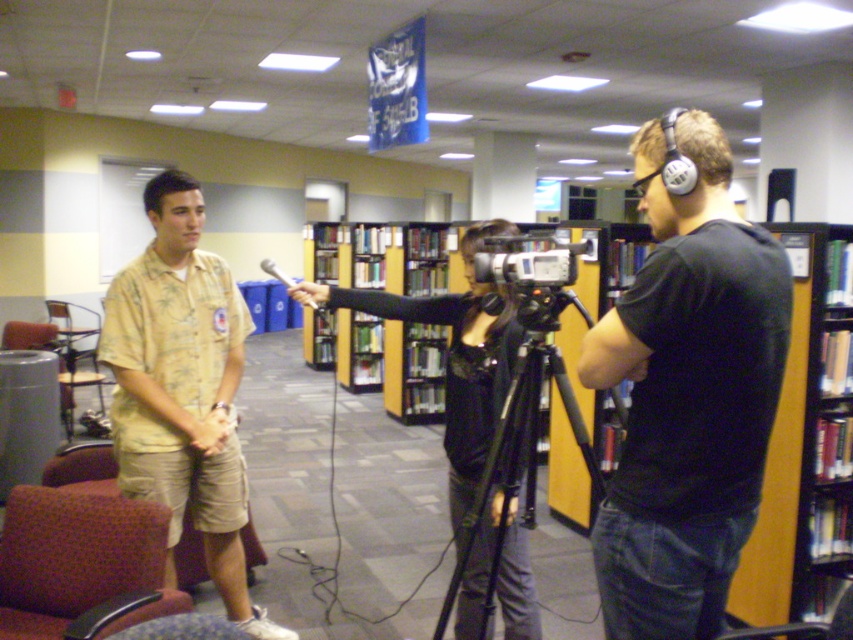
Measure the distance between black matte headphones at right and black matte tripod at center.

They are 16.38 inches apart.

Is point (664, 152) closer to viewer compared to point (531, 301)?

Yes, it is.

Which is in front, point (643, 144) or point (521, 449)?

Point (643, 144) is in front.

Locate an element on the screen. Image resolution: width=853 pixels, height=640 pixels. black matte headphones at right is located at coordinates (688, 388).

Does yellow wood bookcase at center have a greater width compared to velvet-like maroon swivel chair at lower left?

Incorrect, yellow wood bookcase at center's width does not surpass velvet-like maroon swivel chair at lower left's.

Between point (809, 445) and point (22, 506), which one is positioned behind?

The point (809, 445) is more distant.

Between point (769, 557) and point (39, 624), which one is positioned behind?

The point (769, 557) is more distant.

Find the location of a particular element. yellow wood bookcase at center is located at coordinates (805, 444).

Can you confirm if velvet-like maroon swivel chair at lower left is shorter than wooden bookcase at center?

Yes.

Between velvet-like maroon swivel chair at lower left and wooden bookcase at center, which one has more height?

With more height is wooden bookcase at center.

Which is behind, point (99, 636) or point (563, 458)?

The point (563, 458) is behind.

Locate an element on the screen. velvet-like maroon swivel chair at lower left is located at coordinates (78, 561).